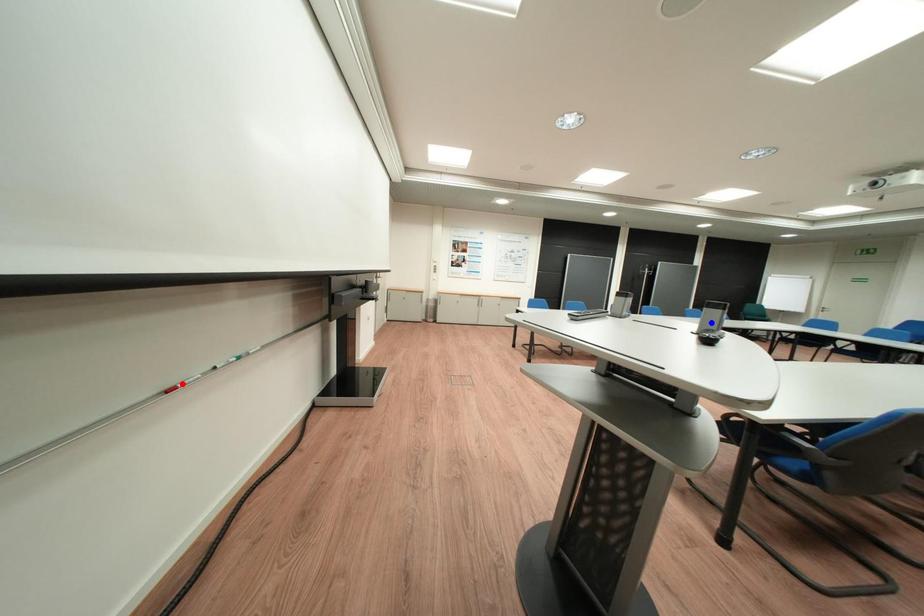
Question: Which of the two points in the image is closer to the camera?

Choices:
 (A) Blue point is closer.
 (B) Red point is closer.

Answer: (B)